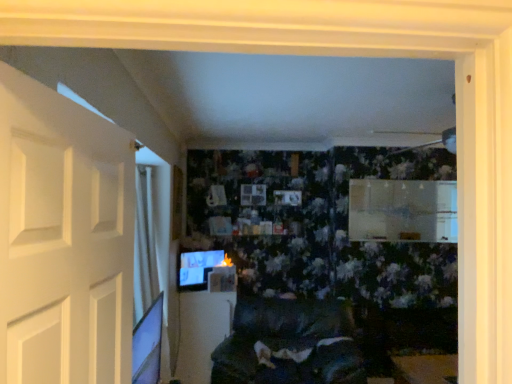
The height and width of the screenshot is (384, 512). What do you see at coordinates (63, 239) in the screenshot?
I see `white matte door at left` at bounding box center [63, 239].

The width and height of the screenshot is (512, 384). In order to click on velvet dark gray couch at center in this screenshot , I will do `click(289, 344)`.

Is velvet dark gray couch at center oriented towards white glossy table at center?

No, velvet dark gray couch at center is not facing towards white glossy table at center.

Is velvet dark gray couch at center beside white glossy table at center?

velvet dark gray couch at center is not next to white glossy table at center, and they're not touching.

From a real-world perspective, who is located higher, velvet dark gray couch at center or white glossy table at center?

From a 3D spatial view, white glossy table at center is above.

In the image, is velvet dark gray couch at center on the left side or the right side of white glossy table at center?

velvet dark gray couch at center is positioned on white glossy table at center's right side.

From the image's perspective, does matte black monitor at lower left appear higher than velvet dark gray couch at center?

Yes.

How many degrees apart are the facing directions of matte black monitor at lower left and velvet dark gray couch at center?

48.5 degrees separate the facing orientations of matte black monitor at lower left and velvet dark gray couch at center.

Which of these two, matte black monitor at lower left or velvet dark gray couch at center, is smaller?

With smaller size is matte black monitor at lower left.

Could you tell me if white matte door at left is facing white glossy table at center?

No, white matte door at left is not oriented towards white glossy table at center.

Considering the relative positions of white matte door at left and white glossy table at center in the image provided, is white matte door at left to the left of white glossy table at center from the viewer's perspective?

In fact, white matte door at left is to the right of white glossy table at center.

Can you confirm if white matte door at left is wider than white glossy table at center?

No, white matte door at left is not wider than white glossy table at center.

Is white matte door at left shorter than white glossy table at center?

Indeed, white matte door at left has a lesser height compared to white glossy table at center.

Can you confirm if white matte door at left is taller than velvet dark gray couch at center?

No, white matte door at left is not taller than velvet dark gray couch at center.

Would you say white matte door at left is to the left or to the right of velvet dark gray couch at center in the picture?

Clearly, white matte door at left is on the left of velvet dark gray couch at center in the image.

Is velvet dark gray couch at center at the back of white matte door at left?

No, white matte door at left is not facing the opposite direction of velvet dark gray couch at center.

Does point (118, 170) come behind point (341, 332)?

That is False.

Which object is further away from the camera taking this photo, white glossy table at center or velvet dark gray couch at center?

white glossy table at center is further away from the camera.

What's the angular difference between white glossy table at center and velvet dark gray couch at center's facing directions?

Answer: 9.29 degrees separate the facing orientations of white glossy table at center and velvet dark gray couch at center.

Based on the photo, who is taller, white glossy table at center or velvet dark gray couch at center?

white glossy table at center is taller.

Is white glossy table at center looking in the opposite direction of velvet dark gray couch at center?

No, velvet dark gray couch at center is not at the back of white glossy table at center.

From the image's perspective, which one is positioned higher, white glossy table at center or matte black monitor at lower left?

matte black monitor at lower left appears higher in the image.

Based on the photo, is white glossy table at center closer to camera compared to matte black monitor at lower left?

Yes, the depth of white glossy table at center is less than that of matte black monitor at lower left.

Is white glossy table at center oriented away from matte black monitor at lower left?

No, white glossy table at center is not facing away from matte black monitor at lower left.

Is white glossy table at center smaller than matte black monitor at lower left?

Incorrect, white glossy table at center is not smaller in size than matte black monitor at lower left.

Identify the location of door on the right of matte black monitor at lower left. The width and height of the screenshot is (512, 384). (63, 239).

Considering the positions of objects matte black monitor at lower left and white matte door at left in the image provided, who is behind, matte black monitor at lower left or white matte door at left?

matte black monitor at lower left is more distant.

Which point is more distant from viewer, (x=207, y=260) or (x=119, y=237)?

The point (x=207, y=260) is behind.

Is matte black monitor at lower left far from white matte door at left?

Yes.

Find the location of a particular element. This screenshot has height=384, width=512. table above the velvet dark gray couch at center (from a real-world perspective) is located at coordinates (202, 332).

I want to click on furniture below the matte black monitor at lower left (from the image's perspective), so click(x=289, y=344).

Which object lies further to the anchor point white glossy table at center, matte black monitor at lower left or white matte door at left?

white matte door at left.

Based on their spatial positions, is white matte door at left or white glossy table at center further from velvet dark gray couch at center?

Among the two, white matte door at left is located further to velvet dark gray couch at center.

When comparing their distances from white matte door at left, does matte black monitor at lower left or white glossy table at center seem further?

Based on the image, matte black monitor at lower left appears to be further to white matte door at left.

Based on their spatial positions, is matte black monitor at lower left or white matte door at left further from velvet dark gray couch at center?

white matte door at left is further to velvet dark gray couch at center.

Estimate the real-world distances between objects in this image. Which object is further from matte black monitor at lower left, white glossy table at center or velvet dark gray couch at center?

velvet dark gray couch at center is positioned further to the anchor matte black monitor at lower left.

When comparing their distances from velvet dark gray couch at center, does white glossy table at center or matte black monitor at lower left seem closer?

white glossy table at center is closer to velvet dark gray couch at center.

Considering their positions, is velvet dark gray couch at center positioned closer to matte black monitor at lower left than white matte door at left?

Among the two, velvet dark gray couch at center is located nearer to matte black monitor at lower left.

Estimate the real-world distances between objects in this image. Which object is further from white matte door at left, velvet dark gray couch at center or matte black monitor at lower left?

matte black monitor at lower left lies further to white matte door at left than the other object.

Locate an element on the screen. This screenshot has width=512, height=384. table positioned between velvet dark gray couch at center and matte black monitor at lower left from near to far is located at coordinates (202, 332).

Find the location of a particular element. table between white matte door at left and matte black monitor at lower left in the front-back direction is located at coordinates (202, 332).

Find the location of a particular element. furniture located between white matte door at left and white glossy table at center in the depth direction is located at coordinates (289, 344).

At what (x,y) coordinates should I click in order to perform the action: click on furniture located between white matte door at left and matte black monitor at lower left in the depth direction. Please return your answer as a coordinate pair (x, y). This screenshot has height=384, width=512. Looking at the image, I should click on 289,344.